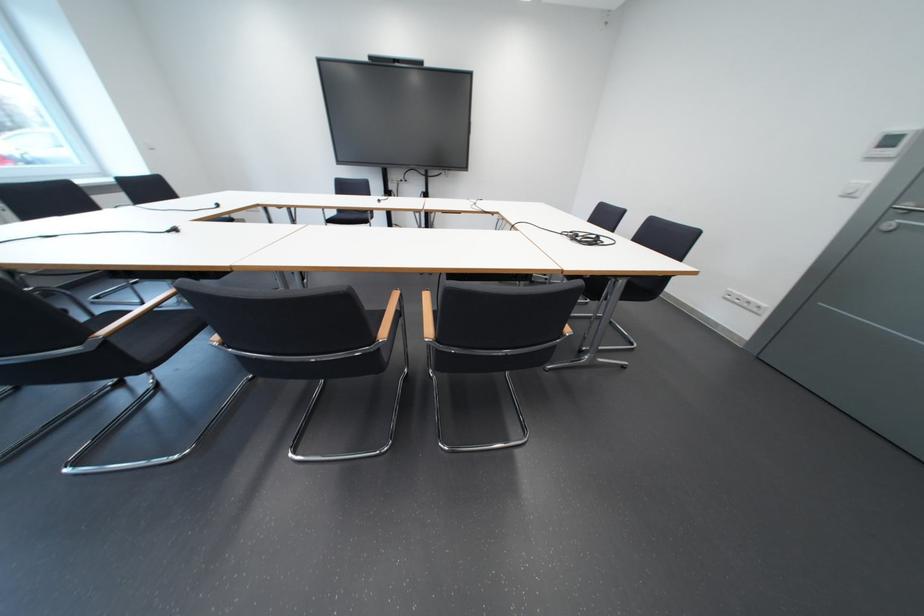
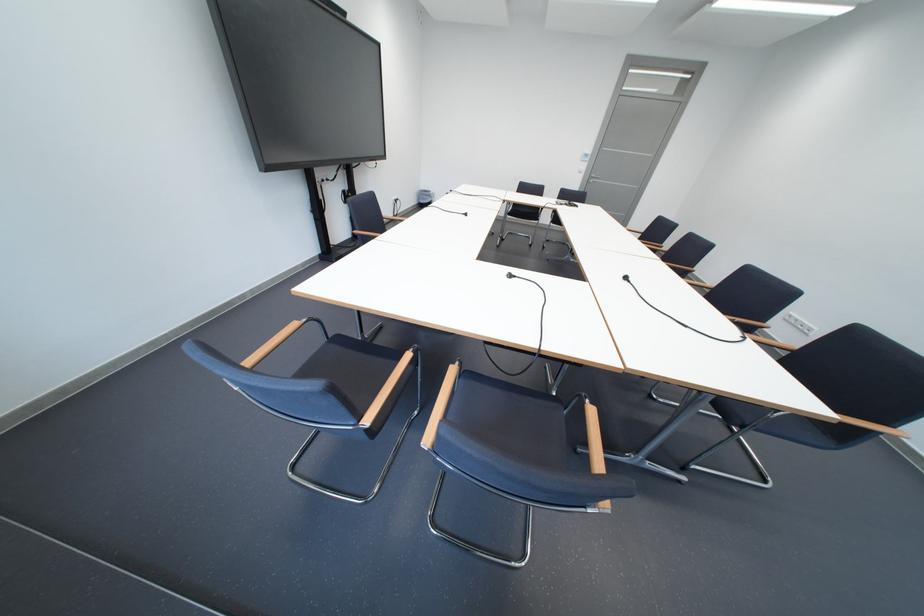
Locate, in the second image, the point that corresponds to (x=882, y=177) in the first image.

(596, 168)